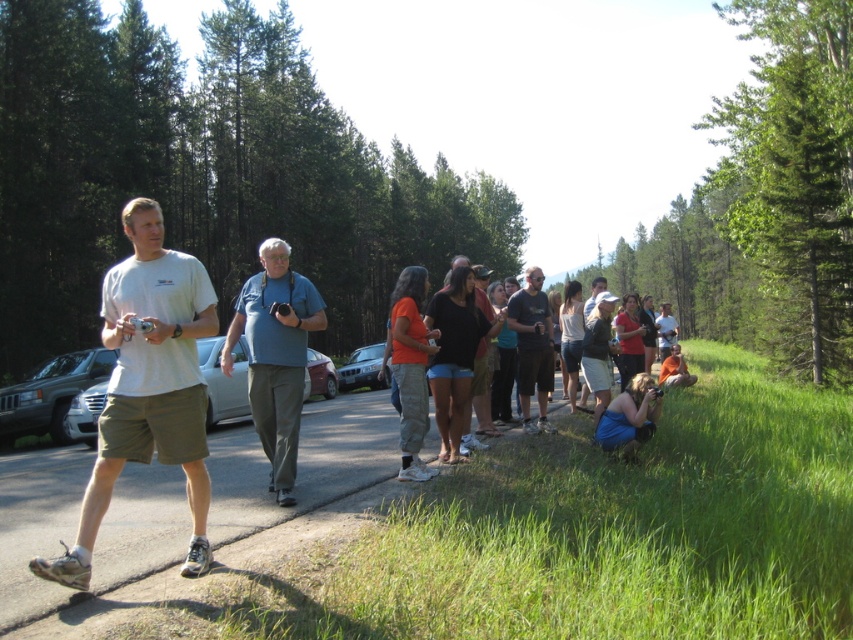
Question: Is blue cotton shirt at center closer to the viewer compared to blue fabric at lower right?

Choices:
 (A) no
 (B) yes

Answer: (B)

Question: Estimate the real-world distances between objects in this image. Which object is closer to the blue fabric at lower right?

Choices:
 (A) matte blue shirt at center
 (B) orange cotton shirt at center
 (C) brown fabric backpack at lower right
 (D) concrete pavement at center

Answer: (B)

Question: Where is white matte t-shirt at left located in relation to blue fabric at lower right in the image?

Choices:
 (A) right
 (B) left

Answer: (B)

Question: Is silver metallic suv at left to the left of silver metallic car at left from the viewer's perspective?

Choices:
 (A) no
 (B) yes

Answer: (B)

Question: Among these objects, which one is nearest to the camera?

Choices:
 (A) brown fabric backpack at lower right
 (B) silver metallic suv at left

Answer: (B)

Question: Which object appears closest to the camera in this image?

Choices:
 (A) blue cotton shirt at center
 (B) silver metallic car at center
 (C) white matte t-shirt at left
 (D) concrete pavement at center

Answer: (D)